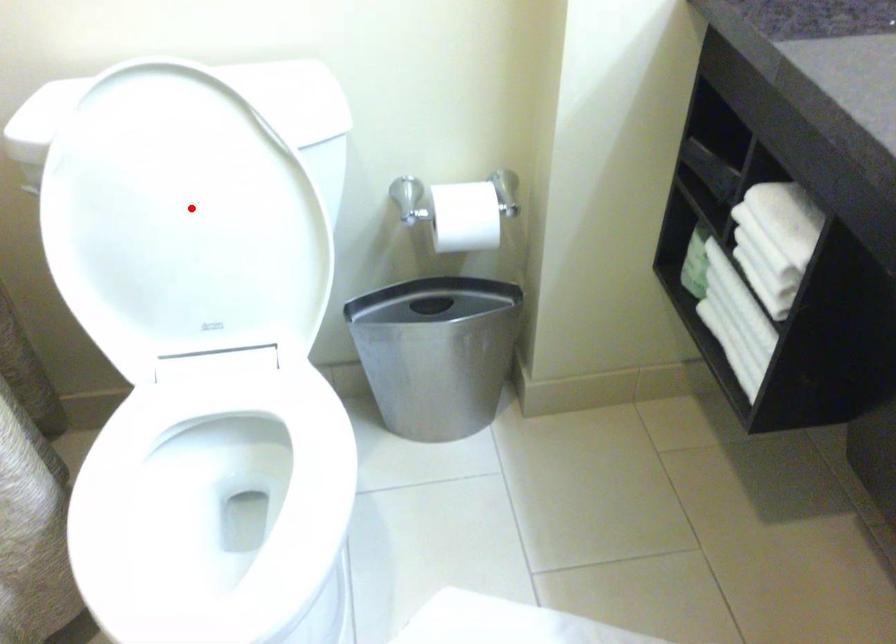
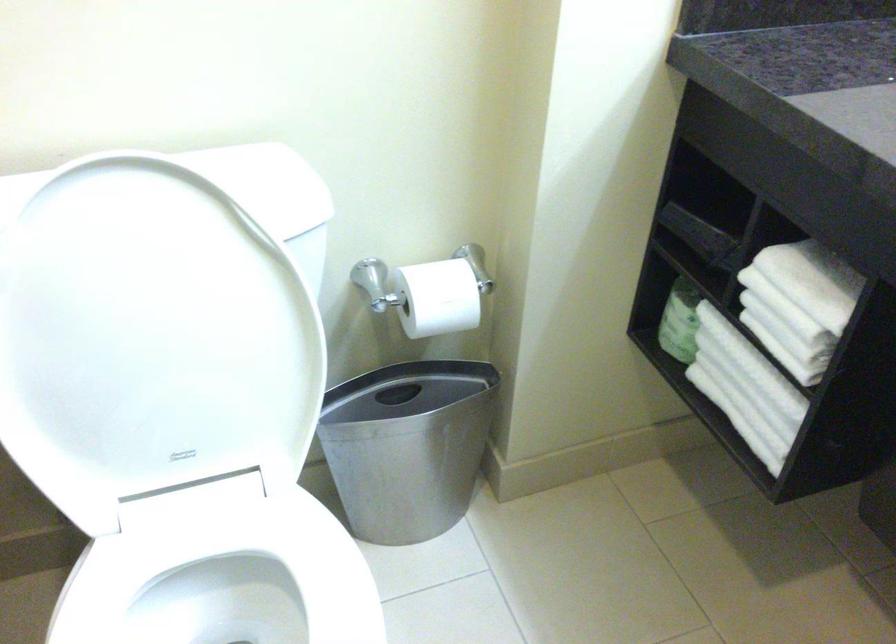
Question: I am providing you with two images of the same scene from different viewpoints. Image1 has a red point marked. In image2, the corresponding 3D location appears at what relative position? Reply with the corresponding letter.

Choices:
 (A) Closer
 (B) Farther

Answer: (A)